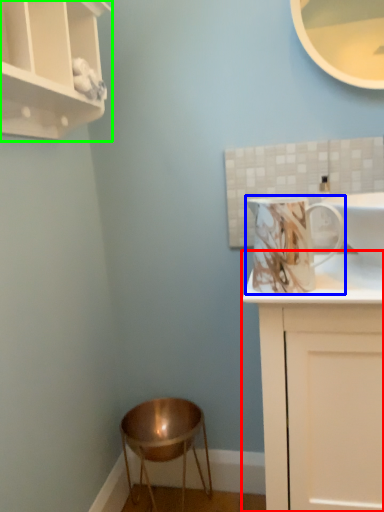
Question: Based on their relative distances, which object is nearer to cabinetry (highlighted by a red box)? Choose from mug (highlighted by a blue box) and cupboard (highlighted by a green box).

Choices:
 (A) mug
 (B) cupboard

Answer: (A)